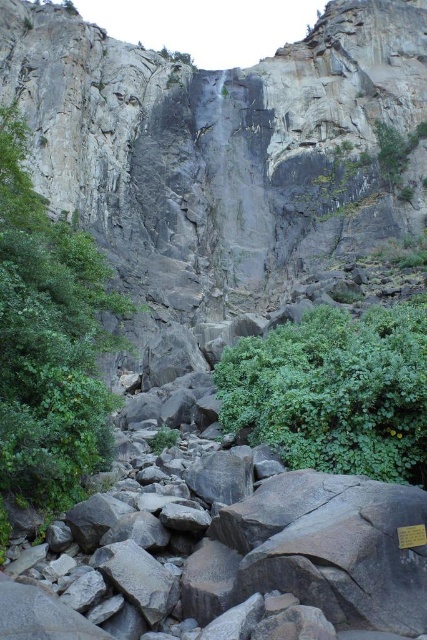
Question: Does green leafy shrubs at center have a smaller size compared to green leafy bush at lower center?

Choices:
 (A) no
 (B) yes

Answer: (A)

Question: Which point appears farthest from the camera in this image?

Choices:
 (A) 359,440
 (B) 44,240

Answer: (B)

Question: Which object appears farthest from the camera in this image?

Choices:
 (A) green leafy bush at lower center
 (B) green leafy shrubs at center

Answer: (A)

Question: Is green leafy shrubs at center thinner than green leafy bush at lower center?

Choices:
 (A) yes
 (B) no

Answer: (A)

Question: In this image, where is green leafy shrubs at center located relative to green leafy bush at lower center?

Choices:
 (A) right
 (B) left

Answer: (B)